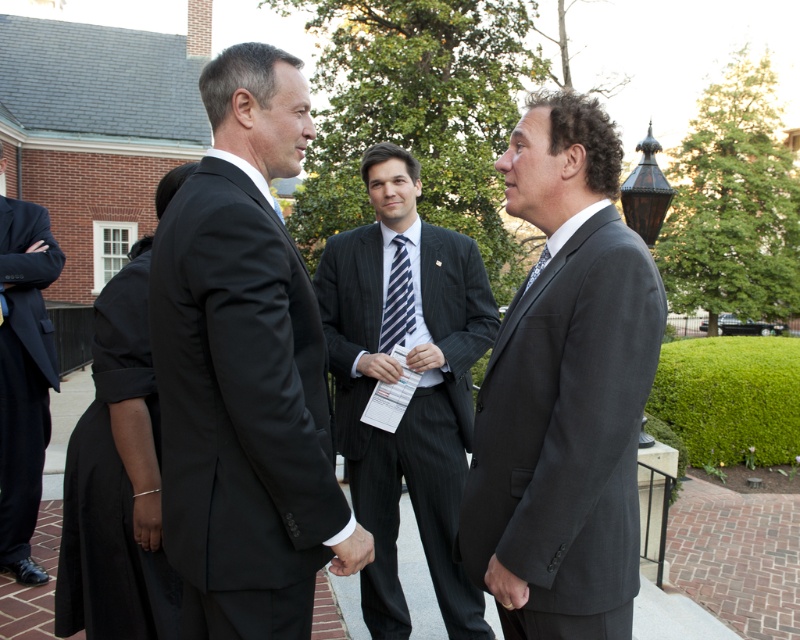
Question: Can you confirm if black satin dress at lower left is wider than striped fabric tie at center?

Choices:
 (A) no
 (B) yes

Answer: (B)

Question: Among these points, which one is nearest to the camera?

Choices:
 (A) (5, 522)
 (B) (468, 476)
 (C) (172, 596)
 (D) (184, 529)

Answer: (D)

Question: Does dark gray pinstripe suit at center appear on the left side of dark gray suit at left?

Choices:
 (A) no
 (B) yes

Answer: (A)

Question: Which object is closer to the camera taking this photo?

Choices:
 (A) black suit at center
 (B) striped fabric tie at center
 (C) dark gray suit at right
 (D) dark gray suit at left

Answer: (A)

Question: Is dark gray suit at right below black satin dress at lower left?

Choices:
 (A) yes
 (B) no

Answer: (B)

Question: Estimate the real-world distances between objects in this image. Which object is closer to the blue striped tie at center?

Choices:
 (A) dark gray suit at left
 (B) black satin dress at lower left

Answer: (B)